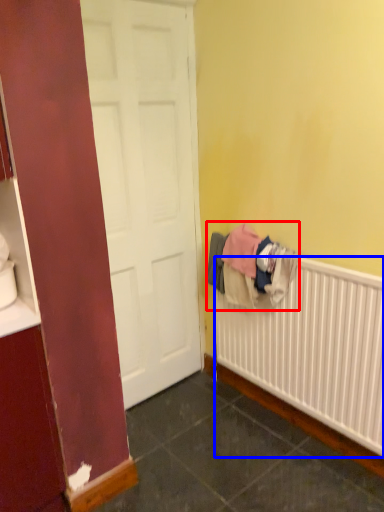
Question: Which object is closer to the camera taking this photo, clothing (highlighted by a red box) or radiator (highlighted by a blue box)?

Choices:
 (A) clothing
 (B) radiator

Answer: (B)